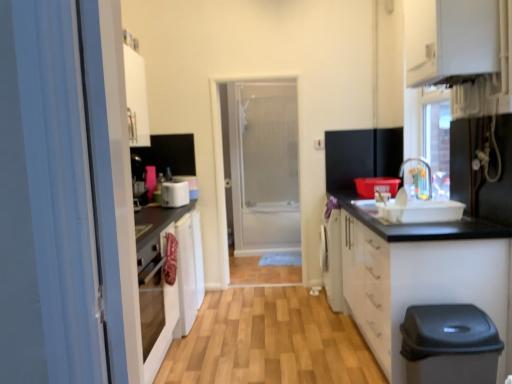
Question: In the image, is white glossy cabinet at upper right, acting as the 2th cabinetry starting from the bottom, positioned in front of or behind metallic silver faucet at upper right, which is the second appliance from left to right?

Choices:
 (A) front
 (B) behind

Answer: (B)

Question: Is point (477, 51) closer or farther from the camera than point (451, 182)?

Choices:
 (A) farther
 (B) closer

Answer: (B)

Question: Estimate the real-world distances between objects in this image. Which object is farther from the transparent glass door at center?

Choices:
 (A) wooden floor at center
 (B) white glossy cabinet at upper right, acting as the 2th cabinetry starting from the bottom
 (C) metallic silver faucet at upper right, which is the second appliance from left to right
 (D) white glossy cabinet at lower right, the 2th cabinetry viewed from the top
 (E) white plastic toaster at center, marked as the second appliance in a right-to-left arrangement

Answer: (B)

Question: Estimate the real-world distances between objects in this image. Which object is closer to the white glossy cabinet at upper right, acting as the 2th cabinetry starting from the bottom?

Choices:
 (A) white glossy cabinet at lower right, the 2th cabinetry viewed from the top
 (B) wooden floor at center
 (C) white plastic toaster at center, which is counted as the first appliance, starting from the back
 (D) transparent glass door at center
 (E) metallic silver faucet at upper right, which ranks as the second appliance in back-to-front order

Answer: (E)